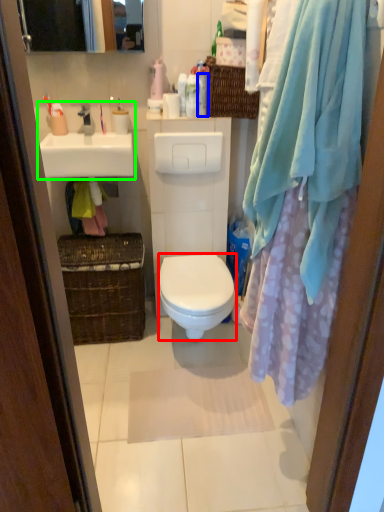
Question: Which object is positioned farthest from bidet (highlighted by a red box)? Select from toiletry (highlighted by a blue box) and sink (highlighted by a green box).

Choices:
 (A) toiletry
 (B) sink

Answer: (A)